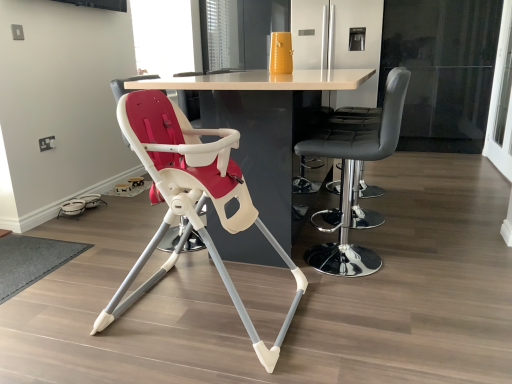
Consider the image. Measure the distance between point (294, 142) and camera.

The depth of point (294, 142) is 7.36 feet.

How much space does matte white highchair at center, which appears as the second chair when viewed from the right, occupy vertically?

34.56 inches.

Where is `transparent glass window screen at upper center`? Image resolution: width=512 pixels, height=384 pixels. transparent glass window screen at upper center is located at coordinates (166, 36).

Describe the element at coordinates (501, 100) in the screenshot. I see `transparent glass screen door at right, which ranks as the second screen door in left-to-right order` at that location.

Identify the location of white glossy table at center. Image resolution: width=512 pixels, height=384 pixels. (265, 125).

Is white glossy refrigerator at upper center, placed as the 2th screen door when sorted from front to back, facing towards white glossy table at center?

Yes, white glossy refrigerator at upper center, placed as the 2th screen door when sorted from front to back, faces towards white glossy table at center.

Is the surface of white glossy refrigerator at upper center, the second screen door positioned from the right, in direct contact with white glossy table at center?

No, white glossy refrigerator at upper center, the second screen door positioned from the right, is not beside white glossy table at center.

From a real-world perspective, which object stands above the other?

From a 3D spatial view, white glossy refrigerator at upper center, the second screen door positioned from the right, is above.

Would you say white glossy refrigerator at upper center, marked as the 1th screen door in a left-to-right arrangement, contains white glossy table at center?

No.

Is white glossy refrigerator at upper center, marked as the 1th screen door in a left-to-right arrangement, surrounded by matte white highchair at center, which appears as the second chair when viewed from the right?

No, matte white highchair at center, which appears as the second chair when viewed from the right, does not contain white glossy refrigerator at upper center, marked as the 1th screen door in a left-to-right arrangement.

How many degrees apart are the facing directions of matte white highchair at center, which appears as the second chair when viewed from the right, and white glossy refrigerator at upper center, marked as the 1th screen door in a left-to-right arrangement?

matte white highchair at center, which appears as the second chair when viewed from the right, and white glossy refrigerator at upper center, marked as the 1th screen door in a left-to-right arrangement, are facing 88.9 degrees away from each other.

Is matte white highchair at center, which appears as the second chair when viewed from the right, positioned behind white glossy refrigerator at upper center, placed as the 2th screen door when sorted from front to back?

No, it is not.

Considering the relative sizes of matte white highchair at center, which is the 1th chair in left-to-right order, and white glossy refrigerator at upper center, which is the 1th screen door from back to front, in the image provided, is matte white highchair at center, which is the 1th chair in left-to-right order, thinner than white glossy refrigerator at upper center, which is the 1th screen door from back to front,?

Incorrect, the width of matte white highchair at center, which is the 1th chair in left-to-right order, is not less than that of white glossy refrigerator at upper center, which is the 1th screen door from back to front.

From the picture: How far apart are transparent glass window screen at upper center and transparent glass screen door at right, which ranks as the second screen door in left-to-right order?

transparent glass window screen at upper center and transparent glass screen door at right, which ranks as the second screen door in left-to-right order, are 3.15 meters apart.

From the image's perspective, is transparent glass window screen at upper center on transparent glass screen door at right, marked as the second screen door in a back-to-front arrangement?

Yes.

Between transparent glass window screen at upper center and transparent glass screen door at right, which appears as the 1th screen door when viewed from the right, which one has smaller width?

Thinner between the two is transparent glass screen door at right, which appears as the 1th screen door when viewed from the right.

Which is further, (252,204) or (179,69)?

Positioned behind is point (179,69).

Is matte white highchair at center, which is the 1th chair in left-to-right order, oriented away from transparent glass window screen at upper center?

No, matte white highchair at center, which is the 1th chair in left-to-right order,'s orientation is not away from transparent glass window screen at upper center.

Is matte white highchair at center, which appears as the second chair when viewed from the right, in contact with transparent glass window screen at upper center?

No, matte white highchair at center, which appears as the second chair when viewed from the right, is not with transparent glass window screen at upper center.

From a real-world perspective, is matte white highchair at center, which is the 1th chair in left-to-right order, located higher than transparent glass window screen at upper center?

No, from a real-world perspective, matte white highchair at center, which is the 1th chair in left-to-right order, is not on top of transparent glass window screen at upper center.

Considering the positions of objects transparent glass screen door at right, marked as the second screen door in a back-to-front arrangement, and transparent glass window screen at upper center in the image provided, who is more to the left, transparent glass screen door at right, marked as the second screen door in a back-to-front arrangement, or transparent glass window screen at upper center?

From the viewer's perspective, transparent glass window screen at upper center appears more on the left side.

In the scene shown: Between transparent glass screen door at right, which appears as the first screen door when viewed from the front, and transparent glass window screen at upper center, which one is positioned behind?

transparent glass window screen at upper center is more distant.

Between transparent glass screen door at right, which appears as the first screen door when viewed from the front, and transparent glass window screen at upper center, which one has less height?

transparent glass window screen at upper center.

The image size is (512, 384). I want to click on window screen above the transparent glass screen door at right, marked as the second screen door in a back-to-front arrangement (from the image's perspective), so click(x=166, y=36).

Between transparent glass window screen at upper center and white glossy refrigerator at upper center, which is the 1th screen door from back to front, which one is positioned in front?

transparent glass window screen at upper center is closer to the camera.

Could you tell me if transparent glass window screen at upper center is facing white glossy refrigerator at upper center, which is the 1th screen door from back to front?

Yes, transparent glass window screen at upper center faces towards white glossy refrigerator at upper center, which is the 1th screen door from back to front.

Would you consider transparent glass window screen at upper center to be distant from white glossy refrigerator at upper center, marked as the 1th screen door in a left-to-right arrangement?

Yes, transparent glass window screen at upper center and white glossy refrigerator at upper center, marked as the 1th screen door in a left-to-right arrangement, are located far from each other.

Is white glossy refrigerator at upper center, marked as the 1th screen door in a left-to-right arrangement, turned away from transparent glass window screen at upper center?

No, white glossy refrigerator at upper center, marked as the 1th screen door in a left-to-right arrangement, is not facing the opposite direction of transparent glass window screen at upper center.

Is transparent glass window screen at upper center surrounded by white glossy refrigerator at upper center, the second screen door positioned from the right?

No, transparent glass window screen at upper center is not inside white glossy refrigerator at upper center, the second screen door positioned from the right.

Which of these two, white glossy refrigerator at upper center, placed as the 2th screen door when sorted from front to back, or transparent glass window screen at upper center, is thinner?

transparent glass window screen at upper center is thinner.

Is white glossy refrigerator at upper center, marked as the 1th screen door in a left-to-right arrangement, at the left side of transparent glass window screen at upper center?

No, white glossy refrigerator at upper center, marked as the 1th screen door in a left-to-right arrangement, is not to the left of transparent glass window screen at upper center.

From the white glossy table at center, count 2nd screen doors backward and point to it. Please provide its 2D coordinates.

[(338, 43)]

From the white glossy refrigerator at upper center, marked as the 1th screen door in a left-to-right arrangement, count the 2nd chair to the left and point to it. Please provide its 2D coordinates.

[(191, 199)]

From the image, which object appears to be farther from white glossy table at center, transparent glass screen door at right, which appears as the 1th screen door when viewed from the right, or white glossy refrigerator at upper center, which is the 1th screen door from back to front?

The object further to white glossy table at center is transparent glass screen door at right, which appears as the 1th screen door when viewed from the right.

Based on their spatial positions, is white glossy refrigerator at upper center, placed as the 2th screen door when sorted from front to back, or matte white highchair at center, which appears as the second chair when viewed from the right, closer to transparent glass window screen at upper center?

white glossy refrigerator at upper center, placed as the 2th screen door when sorted from front to back.

Considering their positions, is matte white highchair at center, which is the 1th chair in left-to-right order, positioned further to white glossy refrigerator at upper center, placed as the 2th screen door when sorted from front to back, than black leather bar stool at center, which is counted as the first chair, starting from the right?

matte white highchair at center, which is the 1th chair in left-to-right order.

Looking at the image, which one is located closer to black leather bar stool at center, placed as the second chair when sorted from left to right, white glossy table at center or white glossy refrigerator at upper center, placed as the 2th screen door when sorted from front to back?

white glossy table at center is closer to black leather bar stool at center, placed as the second chair when sorted from left to right.

Based on the photo, when comparing their distances from matte white highchair at center, which appears as the second chair when viewed from the right, does black leather bar stool at center, placed as the second chair when sorted from left to right, or white glossy refrigerator at upper center, the second screen door positioned from the right, seem further?

Among the two, white glossy refrigerator at upper center, the second screen door positioned from the right, is located further to matte white highchair at center, which appears as the second chair when viewed from the right.

Looking at the image, which one is located closer to transparent glass window screen at upper center, white glossy table at center or transparent glass screen door at right, which appears as the 1th screen door when viewed from the right?

white glossy table at center lies closer to transparent glass window screen at upper center than the other object.

Estimate the real-world distances between objects in this image. Which object is further from transparent glass window screen at upper center, black leather bar stool at center, placed as the second chair when sorted from left to right, or transparent glass screen door at right, marked as the second screen door in a back-to-front arrangement?

The object further to transparent glass window screen at upper center is transparent glass screen door at right, marked as the second screen door in a back-to-front arrangement.

When comparing their distances from white glossy refrigerator at upper center, placed as the 2th screen door when sorted from front to back, does matte white highchair at center, which is the 1th chair in left-to-right order, or white glossy table at center seem further?

matte white highchair at center, which is the 1th chair in left-to-right order.

The width and height of the screenshot is (512, 384). Find the location of `chair between matte white highchair at center, which is the 1th chair in left-to-right order, and transparent glass screen door at right, which appears as the first screen door when viewed from the front, from left to right`. chair between matte white highchair at center, which is the 1th chair in left-to-right order, and transparent glass screen door at right, which appears as the first screen door when viewed from the front, from left to right is located at coordinates (353, 177).

Identify the location of table between matte white highchair at center, which is the 1th chair in left-to-right order, and black leather bar stool at center, which is counted as the first chair, starting from the right, in the horizontal direction. This screenshot has width=512, height=384. (265, 125).

Identify the location of chair between white glossy table at center and transparent glass screen door at right, which appears as the first screen door when viewed from the front, from left to right. Image resolution: width=512 pixels, height=384 pixels. (353, 177).

This screenshot has width=512, height=384. Find the location of `window screen between white glossy table at center and white glossy refrigerator at upper center, the second screen door positioned from the right, in the front-back direction`. window screen between white glossy table at center and white glossy refrigerator at upper center, the second screen door positioned from the right, in the front-back direction is located at coordinates (166, 36).